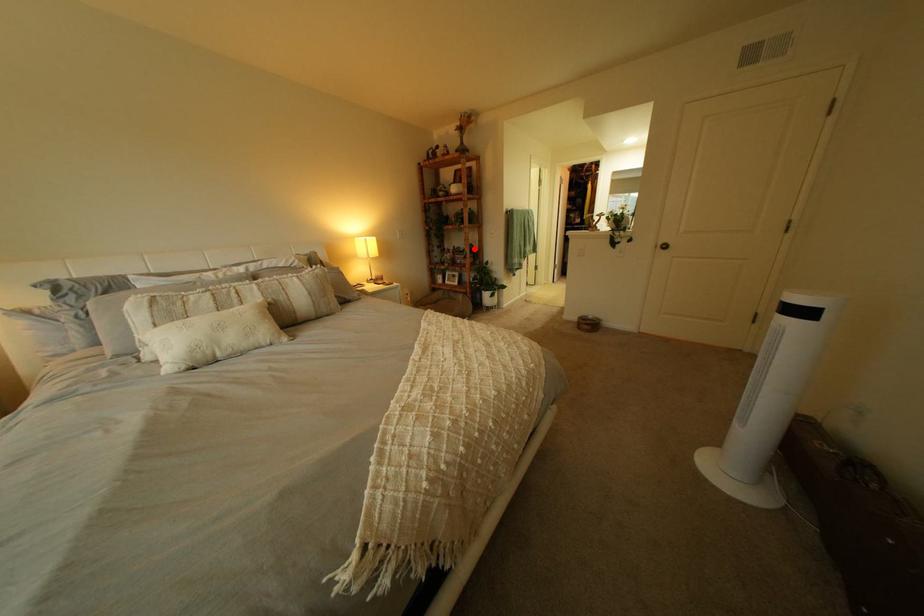
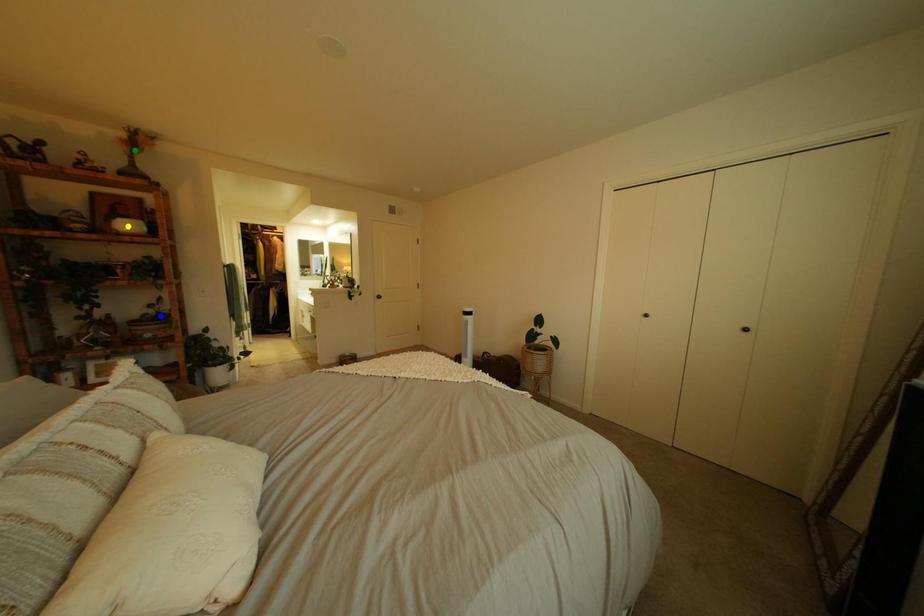
Question: I am providing you with two images of the same scene from different viewpoints. A red point is marked on the first image. You are given multiple points on the second image. Which mark in image 2 goes with the point in image 1?

Choices:
 (A) green point
 (B) blue point
 (C) yellow point

Answer: (B)